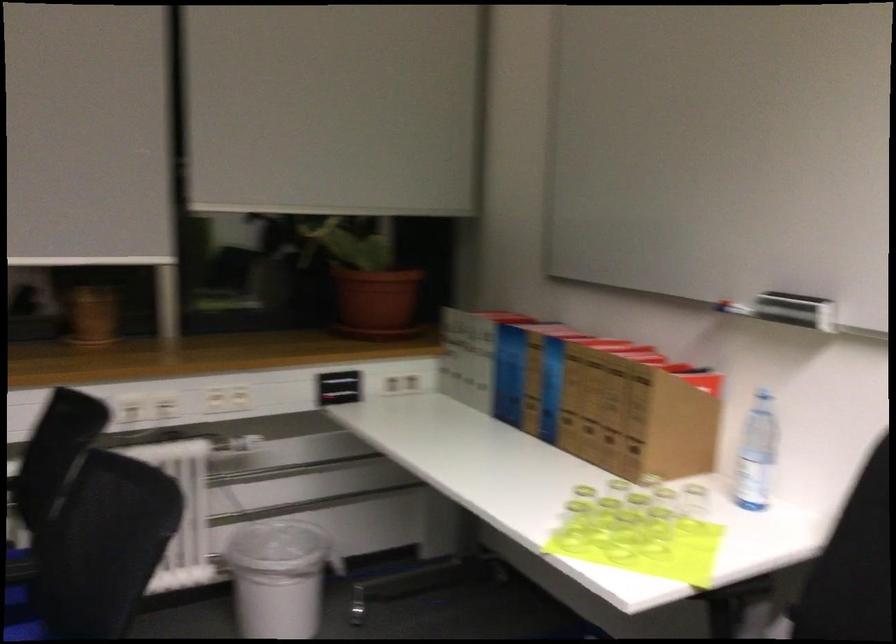
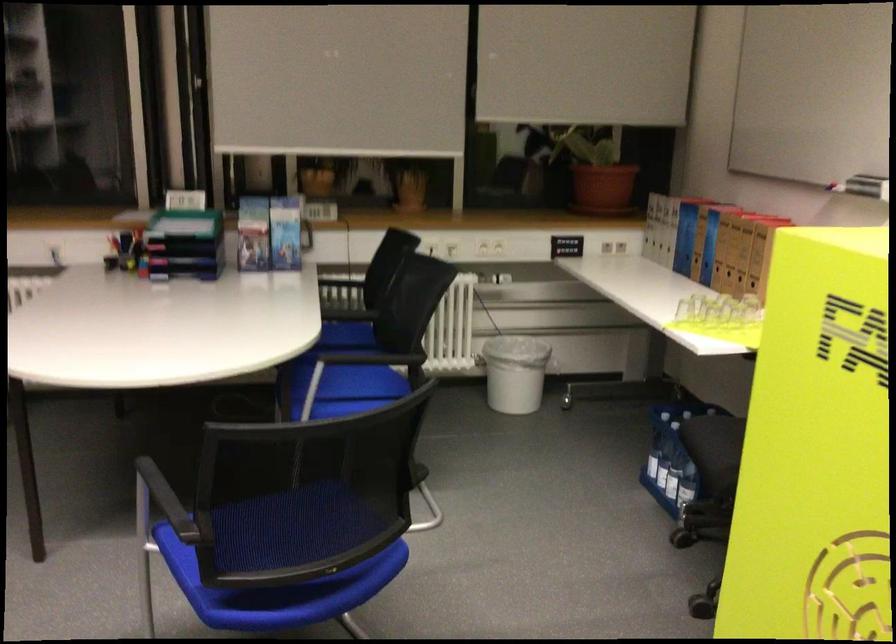
The point at (506, 377) is marked in the first image. Where is the corresponding point in the second image?

(685, 238)